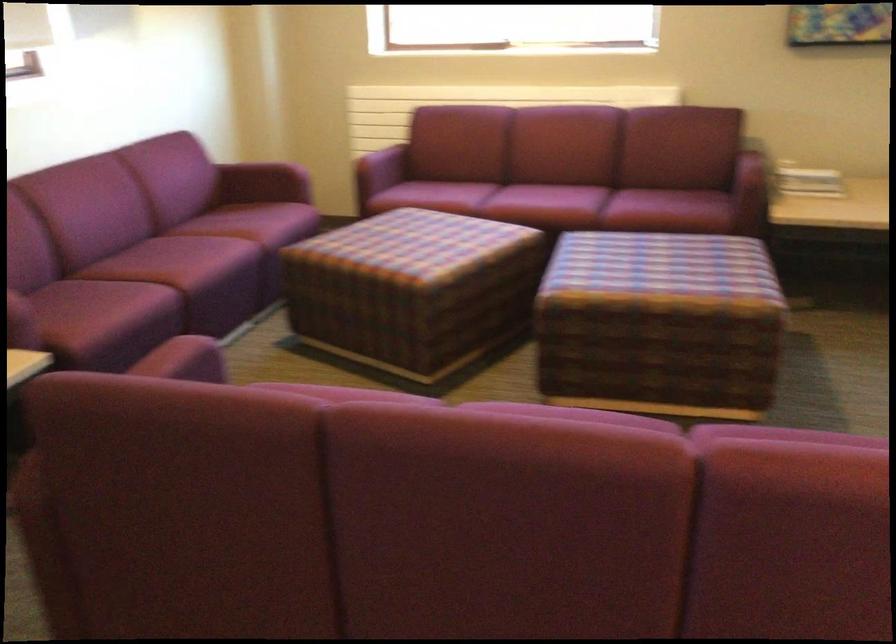
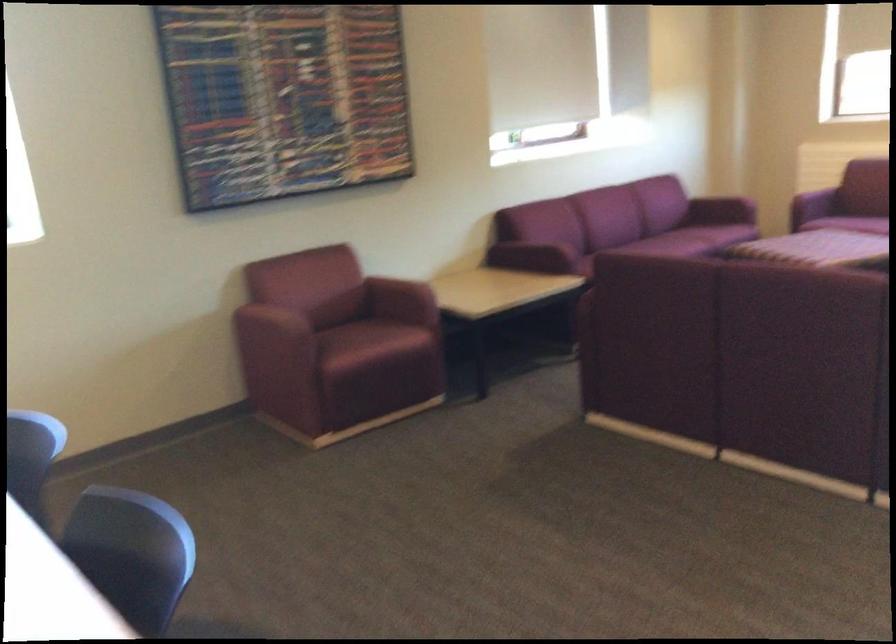
Find the pixel in the second image that matches pixel 263 184 in the first image.

(720, 211)